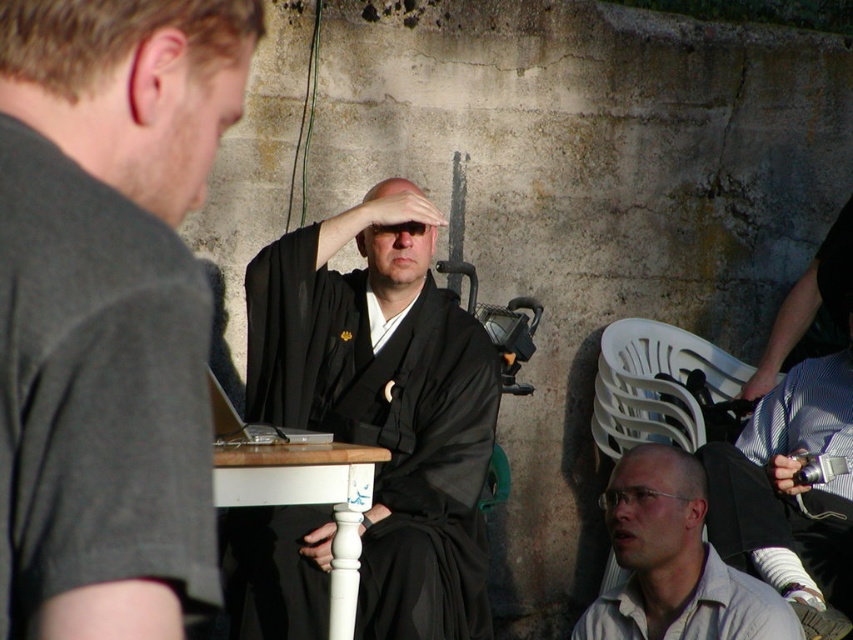
Question: Can you confirm if white painted wood table at center is smaller than white cotton shirt at lower right?

Choices:
 (A) no
 (B) yes

Answer: (A)

Question: Which of these objects is positioned closest to the black striped shirt at right?

Choices:
 (A) white painted wood table at center
 (B) black silk kimono at center
 (C) blue striped shirt at lower right

Answer: (C)

Question: From the image, what is the correct spatial relationship of white cotton shirt at lower right in relation to silver metallic laptop at center?

Choices:
 (A) left
 (B) right

Answer: (B)

Question: Among these objects, which one is nearest to the camera?

Choices:
 (A) blue striped shirt at lower right
 (B) black silk kimono at center
 (C) white painted wood table at center
 (D) light beige cotton shirt at lower right

Answer: (C)

Question: Which point is farther to the camera?

Choices:
 (A) white painted wood table at center
 (B) black striped shirt at right

Answer: (B)

Question: Can you confirm if black striped shirt at right is smaller than silver metallic laptop at center?

Choices:
 (A) yes
 (B) no

Answer: (B)